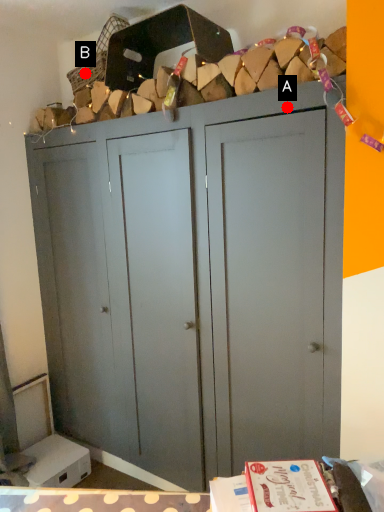
Question: Two points are circled on the image, labeled by A and B beside each circle. Among these points, which one is nearest to the camera?

Choices:
 (A) A is closer
 (B) B is closer

Answer: (A)